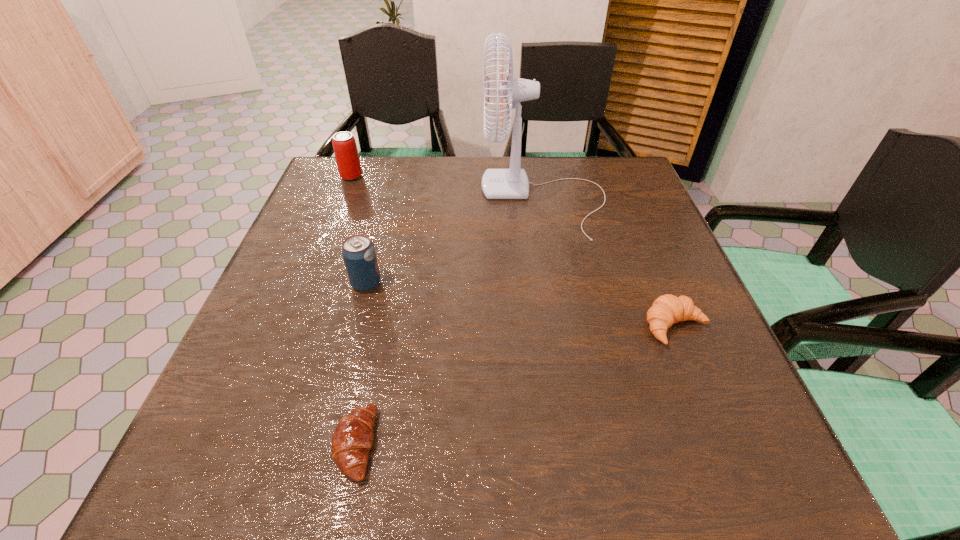
What are the coordinates of `vacant area that satisfies the following two spatial constraints: 1. on the front side of the second shortest object; 2. on the right side of the third farthest object` in the screenshot? It's located at (355, 327).

Where is `vacant space that satisfies the following two spatial constraints: 1. on the front-facing side of the fan; 2. on the front side of the pop soda`? The image size is (960, 540). vacant space that satisfies the following two spatial constraints: 1. on the front-facing side of the fan; 2. on the front side of the pop soda is located at coordinates (560, 284).

Identify the location of free region that satisfies the following two spatial constraints: 1. on the front-facing side of the taller crescent roll; 2. on the right side of the fan. This screenshot has height=540, width=960. (567, 327).

Where is `free space that satisfies the following two spatial constraints: 1. on the front side of the beer can; 2. on the left side of the pop soda`? This screenshot has width=960, height=540. free space that satisfies the following two spatial constraints: 1. on the front side of the beer can; 2. on the left side of the pop soda is located at coordinates (309, 284).

At what (x,y) coordinates should I click in order to perform the action: click on free space that satisfies the following two spatial constraints: 1. on the back side of the farther crescent roll; 2. on the front-facing side of the fan. Please return your answer as a coordinate pair (x, y). This screenshot has height=540, width=960. Looking at the image, I should click on (623, 199).